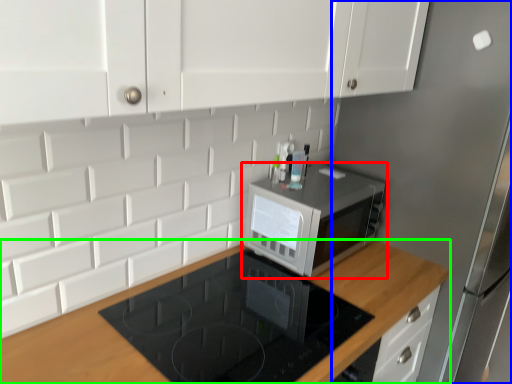
Question: Which object is positioned farthest from microwave oven (highlighted by a red box)? Select from fridge (highlighted by a blue box) and countertop (highlighted by a green box).

Choices:
 (A) fridge
 (B) countertop

Answer: (A)